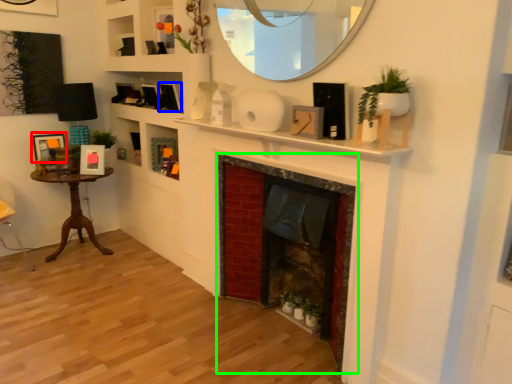
Question: Which is nearer to the picture frame (highlighted by a red box)? picture frame (highlighted by a blue box) or fireplace (highlighted by a green box).

Choices:
 (A) picture frame
 (B) fireplace

Answer: (A)